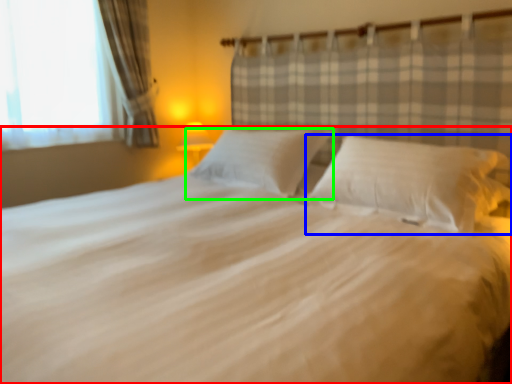
Question: Which is nearer to the bed (highlighted by a red box)? pillow (highlighted by a blue box) or pillow (highlighted by a green box).

Choices:
 (A) pillow
 (B) pillow

Answer: (A)